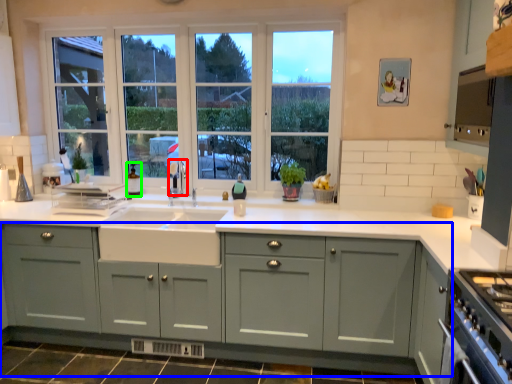
Question: Based on their relative distances, which object is nearer to faucet (highlighted by a red box)? Choose from cabinetry (highlighted by a blue box) and bottle (highlighted by a green box).

Choices:
 (A) cabinetry
 (B) bottle

Answer: (B)